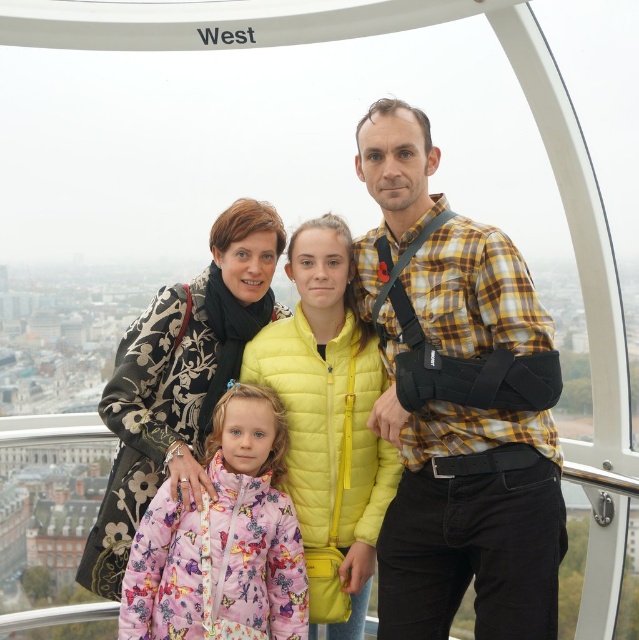
Question: Which of the following is the closest to the observer?

Choices:
 (A) pyautogui.click(x=525, y=625)
 (B) pyautogui.click(x=284, y=493)
 (C) pyautogui.click(x=438, y=237)

Answer: (A)

Question: Which of the following is the farthest from the observer?

Choices:
 (A) (199, 563)
 (B) (362, 280)
 (C) (426, 522)

Answer: (B)

Question: Is yellow quilted jacket at center bigger than pink quilted jacket at lower left?

Choices:
 (A) yes
 (B) no

Answer: (A)

Question: Among these objects, which one is nearest to the camera?

Choices:
 (A) yellow plaid shirt at center
 (B) pink quilted jacket at lower left
 (C) yellow quilted jacket at center

Answer: (A)

Question: Does yellow quilted jacket at center have a larger size compared to yellow plaid shirt at center?

Choices:
 (A) yes
 (B) no

Answer: (A)

Question: Can you confirm if yellow quilted jacket at center is positioned above pink quilted jacket at lower left?

Choices:
 (A) yes
 (B) no

Answer: (A)